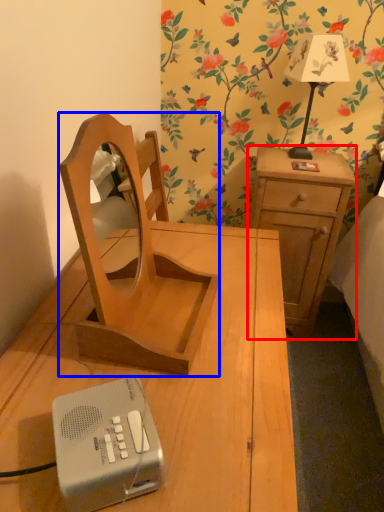
Question: Which of the following is the farthest to the observer, nightstand (highlighted by a red box) or furniture (highlighted by a blue box)?

Choices:
 (A) nightstand
 (B) furniture

Answer: (A)